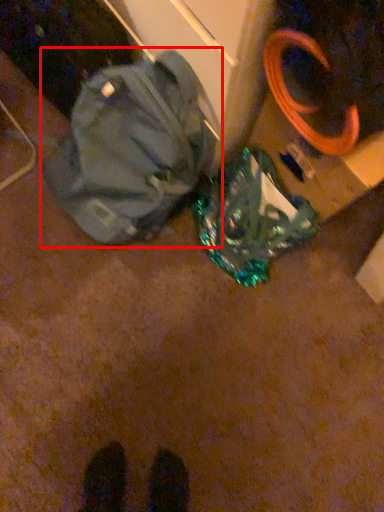
Question: From the image's perspective, what is the correct spatial relationship of backpack (annotated by the red box) in relation to luggage and bags?

Choices:
 (A) above
 (B) below

Answer: (A)